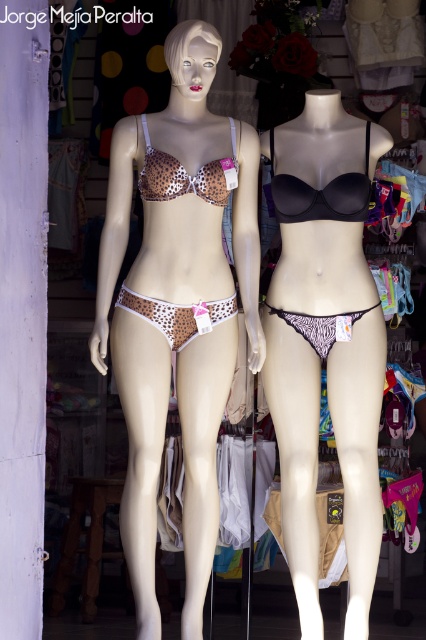
You are standing in a lingerie store and want to take a photo of the mannequins. The store has a rule that photos must be taken from at least 4 meters away to respect privacy. Can you take the photo from the point marked as point (189, 305)?

The point (189, 305) is 4.24 meters away from the camera, which meets the store requirement of at least 4 meters. Therefore, you can take the photo from that point.

You are a store employee arranging items in the lingerie store. You have two leopard print fabric bikinis to place on a shelf. The leopard print fabric bikini at left and the leopard print fabric bikini top at center. Which one should you place higher on the shelf to ensure visibility?

The leopard print fabric bikini at left is taller than the leopard print fabric bikini top at center, so placing the leopard print fabric bikini at left higher on the shelf will ensure better visibility due to its greater height.